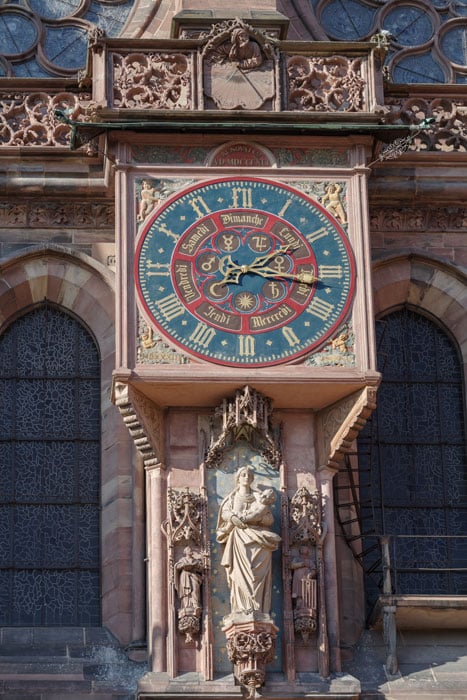
Locate an element on the screen. minute hand of clock is located at coordinates (305, 276).